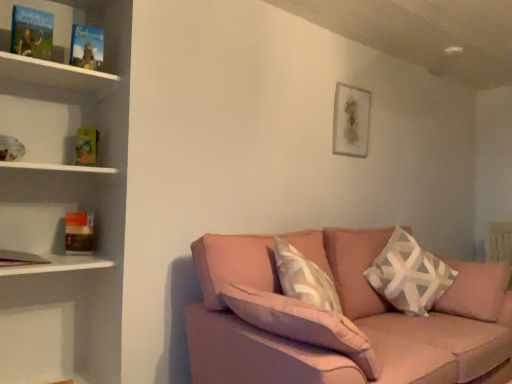
What is the approximate width of yellow paper at left, the 2th paperback book when ordered from bottom to top?

yellow paper at left, the 2th paperback book when ordered from bottom to top, is 1.30 inches wide.

Measure the distance between point (86, 226) and camera.

The distance of point (86, 226) from camera is 2.28 meters.

The height and width of the screenshot is (384, 512). What do you see at coordinates (351, 120) in the screenshot?
I see `wooden frame at upper center` at bounding box center [351, 120].

This screenshot has width=512, height=384. Find the location of `white wooden shelf at left`. white wooden shelf at left is located at coordinates (57, 167).

In the scene shown: In terms of size, does hardcover book at left, arranged as the third paperback book when viewed from the front, appear bigger or smaller than white geometric-patterned pillow at right?

Clearly, hardcover book at left, arranged as the third paperback book when viewed from the front, is smaller in size than white geometric-patterned pillow at right.

Locate an element on the screen. This screenshot has width=512, height=384. throw pillow below the hardcover book at left, arranged as the third paperback book when viewed from the front (from a real-world perspective) is located at coordinates (409, 275).

Is point (74, 224) positioned behind point (449, 279)?

No.

Considering the relative positions of pink fabric couch at lower right and yellow paper at left, the 1th paperback book in the back-to-front sequence, in the image provided, is pink fabric couch at lower right to the left or to the right of yellow paper at left, the 1th paperback book in the back-to-front sequence,?

From the image, it's evident that pink fabric couch at lower right is to the right of yellow paper at left, the 1th paperback book in the back-to-front sequence.

How many degrees apart are the facing directions of pink fabric couch at lower right and yellow paper at left, the 1th paperback book in the back-to-front sequence?

34.2 degrees.

Which is in front, point (212, 268) or point (84, 142)?

The point (212, 268) is closer to the camera.

From a real-world perspective, is pink fabric couch at lower right under yellow paper at left, which is counted as the third paperback book, starting from the top?

Indeed, from a real-world perspective, pink fabric couch at lower right is positioned beneath yellow paper at left, which is counted as the third paperback book, starting from the top.

Is yellow paper at left, positioned as the fourth paperback book in front-to-back order, in front of or behind white wooden shelf at left in the image?

Visually, yellow paper at left, positioned as the fourth paperback book in front-to-back order, is located behind white wooden shelf at left.

How many degrees apart are the facing directions of yellow paper at left, positioned as the fourth paperback book in front-to-back order, and white wooden shelf at left?

yellow paper at left, positioned as the fourth paperback book in front-to-back order, and white wooden shelf at left are facing 34.2 degrees away from each other.

Between yellow paper at left, which is counted as the third paperback book, starting from the top, and white wooden shelf at left, which one has less height?

white wooden shelf at left is shorter.

Is yellow paper at left, the 1th paperback book in the back-to-front sequence, looking in the opposite direction of white wooden shelf at left?

No, white wooden shelf at left is not at the back of yellow paper at left, the 1th paperback book in the back-to-front sequence.

The height and width of the screenshot is (384, 512). I want to click on paperback book that is in front of the hardcover book at upper left, the third paperback book in the bottom-to-top sequence, so click(x=32, y=32).

Which object is wider, hardcover book at upper left, arranged as the 4th paperback book when ordered from the bottom, or hardcover book at upper left, the 3th paperback book viewed from the back?

hardcover book at upper left, arranged as the 4th paperback book when ordered from the bottom.

Is hardcover book at upper left, positioned as the fourth paperback book in back-to-front order, placed right next to hardcover book at upper left, the 3th paperback book viewed from the back?

hardcover book at upper left, positioned as the fourth paperback book in back-to-front order, is not next to hardcover book at upper left, the 3th paperback book viewed from the back, and they're not touching.

Can hardcover book at upper left, which appears as the 2th paperback book when viewed from the top, be found inside hardcover book at upper left, placed as the 1th paperback book when sorted from top to bottom?

No.

Which of these two, white wooden shelf at left or pink fabric couch at lower right, is thinner?

white wooden shelf at left.

Is white wooden shelf at left aimed at pink fabric couch at lower right?

No, white wooden shelf at left is not aimed at pink fabric couch at lower right.

Locate an element on the screen. The height and width of the screenshot is (384, 512). studio couch below the white wooden shelf at left (from a real-world perspective) is located at coordinates (337, 319).

Looking at this image, can you confirm if white wooden shelf at left is bigger than pink fabric couch at lower right?

No.

Is yellow paper at left, which is counted as the third paperback book, starting from the top, with hardcover book at upper left, the third paperback book in the bottom-to-top sequence?

yellow paper at left, which is counted as the third paperback book, starting from the top, and hardcover book at upper left, the third paperback book in the bottom-to-top sequence, are clearly separated.

Can we say yellow paper at left, the 2th paperback book when ordered from bottom to top, lies outside hardcover book at upper left, the third paperback book in the bottom-to-top sequence?

Yes.

Is yellow paper at left, positioned as the fourth paperback book in front-to-back order, at the left side of hardcover book at upper left, the third paperback book in the bottom-to-top sequence?

Indeed, yellow paper at left, positioned as the fourth paperback book in front-to-back order, is positioned on the left side of hardcover book at upper left, the third paperback book in the bottom-to-top sequence.

From a real-world perspective, which is physically below, yellow paper at left, the 2th paperback book when ordered from bottom to top, or hardcover book at upper left, the third paperback book in the bottom-to-top sequence?

yellow paper at left, the 2th paperback book when ordered from bottom to top.

Looking at their sizes, would you say pink fabric couch at lower right is wider or thinner than wooden frame at upper center?

Clearly, pink fabric couch at lower right has more width compared to wooden frame at upper center.

Consider the image. What's the angular difference between pink fabric couch at lower right and wooden frame at upper center's facing directions?

The angle between the facing direction of pink fabric couch at lower right and the facing direction of wooden frame at upper center is 0.107 degrees.

Which is less distant, (463, 329) or (345, 122)?

Clearly, point (463, 329) is closer to the camera than point (345, 122).

From a real-world perspective, is pink fabric couch at lower right located higher than wooden frame at upper center?

No, from a real-world perspective, pink fabric couch at lower right is not over wooden frame at upper center

This screenshot has height=384, width=512. There is a white geometric-patterned pillow at right. What are the coordinates of `the 1st paperback book above it (from the image's perspective)` in the screenshot? It's located at (79, 233).

Identify the location of studio couch that appears on the right of yellow paper at left, positioned as the fourth paperback book in front-to-back order. The image size is (512, 384). (337, 319).

When comparing their distances from white wooden shelf at left, does pink fabric couch at lower right or white geometric-patterned pillow at right seem further?

white geometric-patterned pillow at right lies further to white wooden shelf at left than the other object.

Considering their positions, is hardcover book at left, arranged as the third paperback book when viewed from the front, positioned closer to white wooden shelf at left than pink fabric couch at lower right?

Based on the image, hardcover book at left, arranged as the third paperback book when viewed from the front, appears to be nearer to white wooden shelf at left.

Considering their positions, is wooden frame at upper center positioned closer to white wooden shelf at left than hardcover book at upper left, which appears as the 2th paperback book when viewed from the top?

Based on the image, hardcover book at upper left, which appears as the 2th paperback book when viewed from the top, appears to be nearer to white wooden shelf at left.

Considering their positions, is hardcover book at upper left, which appears as the 2th paperback book when viewed from the top, positioned closer to white geometric-patterned pillow at right than white wooden shelf at left?

Among the two, white wooden shelf at left is located nearer to white geometric-patterned pillow at right.

Considering their positions, is hardcover book at upper left, which appears as the 2th paperback book when viewed from the top, positioned closer to white wooden shelf at left than hardcover book at upper left, positioned as the fourth paperback book in back-to-front order?

hardcover book at upper left, which appears as the 2th paperback book when viewed from the top, lies closer to white wooden shelf at left than the other object.

From the image, which object appears to be farther from white wooden shelf at left, hardcover book at upper left, positioned as the fourth paperback book in back-to-front order, or pink fabric couch at lower right?

Among the two, pink fabric couch at lower right is located further to white wooden shelf at left.

Which object lies nearer to the anchor point white geometric-patterned pillow at right, hardcover book at left, the 4th paperback book positioned from the top, or hardcover book at upper left, which ranks as the first paperback book in front-to-back order?

Based on the image, hardcover book at left, the 4th paperback book positioned from the top, appears to be nearer to white geometric-patterned pillow at right.

Looking at the image, which one is located closer to hardcover book at upper left, the 3th paperback book viewed from the back, white geometric-patterned pillow at right or yellow paper at left, which is counted as the third paperback book, starting from the top?

yellow paper at left, which is counted as the third paperback book, starting from the top, is closer to hardcover book at upper left, the 3th paperback book viewed from the back.

Where is `studio couch situated between hardcover book at upper left, the third paperback book in the bottom-to-top sequence, and wooden frame at upper center from left to right`? The image size is (512, 384). studio couch situated between hardcover book at upper left, the third paperback book in the bottom-to-top sequence, and wooden frame at upper center from left to right is located at coordinates (337, 319).

Locate an element on the screen. This screenshot has height=384, width=512. picture frame between hardcover book at left, which is the 2th paperback book from back to front, and white geometric-patterned pillow at right from left to right is located at coordinates (351, 120).

The width and height of the screenshot is (512, 384). In order to click on picture frame between yellow paper at left, the 2th paperback book when ordered from bottom to top, and white geometric-patterned pillow at right from left to right in this screenshot , I will do `click(351, 120)`.

At what (x,y) coordinates should I click in order to perform the action: click on studio couch between hardcover book at upper left, arranged as the 4th paperback book when ordered from the bottom, and white geometric-patterned pillow at right from left to right. Please return your answer as a coordinate pair (x, y). Image resolution: width=512 pixels, height=384 pixels. Looking at the image, I should click on (337, 319).